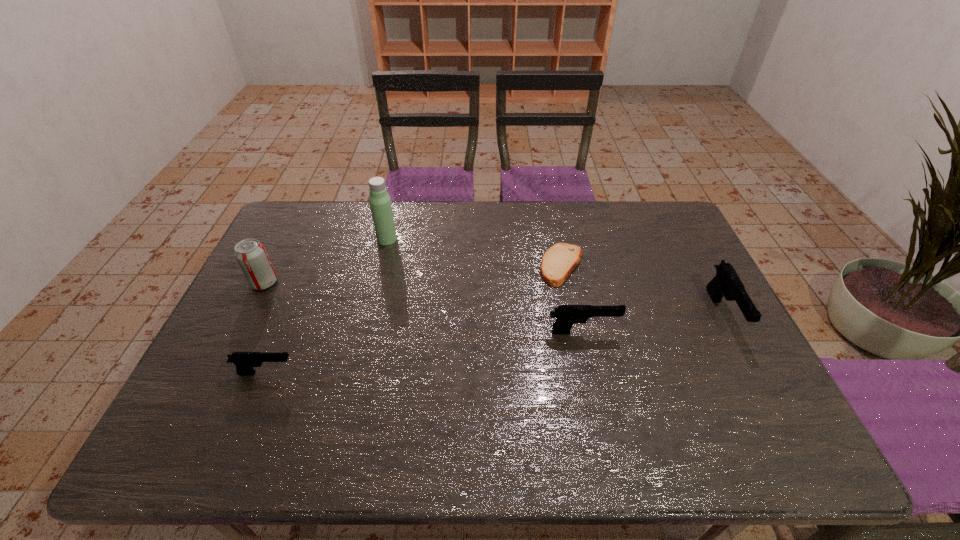
Where is `free location at the far edge of the desktop`? The height and width of the screenshot is (540, 960). free location at the far edge of the desktop is located at coordinates (600, 239).

The width and height of the screenshot is (960, 540). In order to click on vacant area at the near edge in this screenshot , I will do tap(547, 393).

In the image, there is a desktop. Where is `vacant space at the left edge`? This screenshot has width=960, height=540. vacant space at the left edge is located at coordinates (240, 345).

In the image, there is a desktop. Where is `vacant space at the right edge`? The image size is (960, 540). vacant space at the right edge is located at coordinates (671, 264).

This screenshot has height=540, width=960. In the image, there is a desktop. In order to click on free region at the far left corner in this screenshot , I will do `click(329, 217)`.

In the image, there is a desktop. Where is `free space at the near left corner`? This screenshot has height=540, width=960. free space at the near left corner is located at coordinates (242, 403).

Find the location of a particular element. This screenshot has width=960, height=540. free space between the shortest object and the thermos bottle is located at coordinates (474, 252).

I want to click on vacant area that lies between the soda can and the third shortest object, so click(423, 307).

Locate an element on the screen. free space between the leftmost object and the tallest object is located at coordinates (325, 261).

At what (x,y) coordinates should I click in order to perform the action: click on vacant area between the leftmost object and the rightmost pistol. Please return your answer as a coordinate pair (x, y). Looking at the image, I should click on (493, 298).